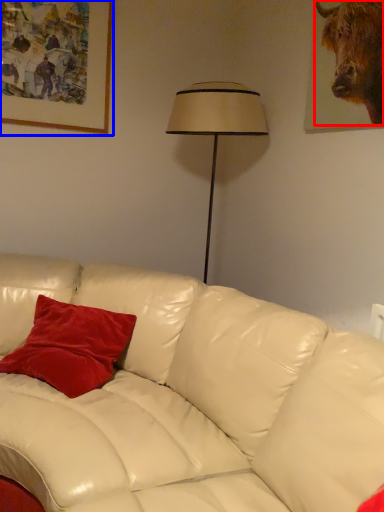
Question: Which object appears closest to the camera in this image, bull (highlighted by a red box) or picture frame (highlighted by a blue box)?

Choices:
 (A) bull
 (B) picture frame

Answer: (A)